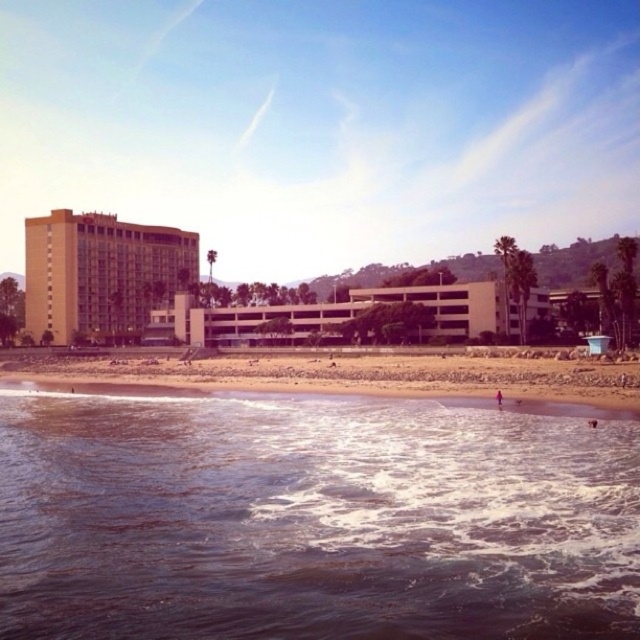
Question: Can you confirm if brown sand at lower center is smaller than beige concrete parking garage at center?

Choices:
 (A) yes
 (B) no

Answer: (A)

Question: Does brown water at lower left have a smaller size compared to beige concrete parking garage at center?

Choices:
 (A) no
 (B) yes

Answer: (B)

Question: Does brown sand at lower center have a greater width compared to beige concrete parking garage at center?

Choices:
 (A) yes
 (B) no

Answer: (A)

Question: Among these points, which one is farthest from the camera?

Choices:
 (A) (339, 330)
 (B) (608, 451)
 (C) (56, 369)

Answer: (C)

Question: Among these objects, which one is nearest to the camera?

Choices:
 (A) brown sand at lower center
 (B) beige concrete parking garage at center

Answer: (A)

Question: Which object appears closest to the camera in this image?

Choices:
 (A) beige concrete building at left
 (B) brown water at lower left
 (C) brown sand at lower center
 (D) beige concrete parking garage at center

Answer: (B)